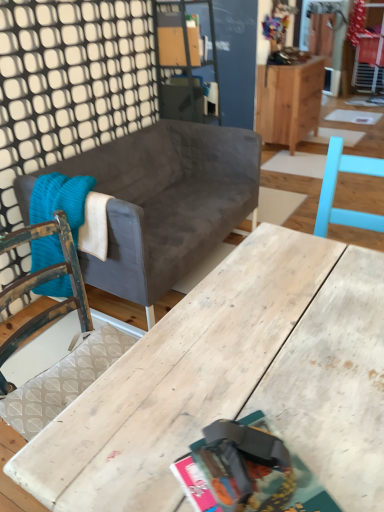
This screenshot has width=384, height=512. What are the coordinates of `free space behind matte paper magazine at center` in the screenshot? It's located at (240, 393).